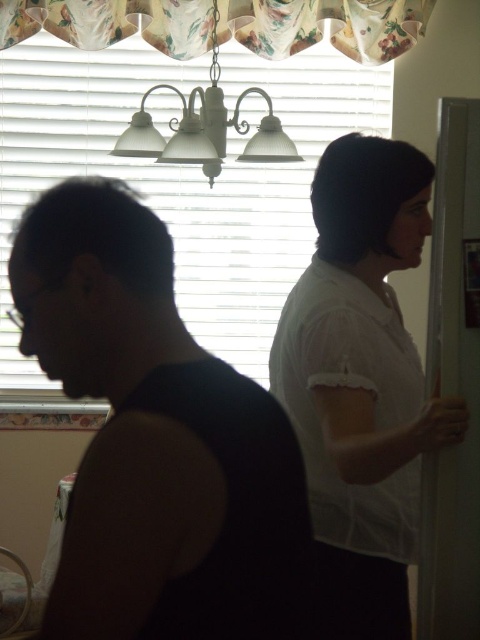
You are a delivery person who needs to place a small package between the white sheer blouse at right and the white textured lamp at upper center. The package is 3.5 feet long. Will it fit in the space between them?

The distance between the white sheer blouse at right and the white textured lamp at upper center is 4.11 feet. Since the package is 3.5 feet long, it will fit in the space between them.

You are trying to locate the white sheer blouse at right in the image. According to the coordinates provided, where would you look first?

You should look first at the coordinates point (361, 381) where the white sheer blouse at right is located.

You are a photographer setting up lighting for a portrait in this scene. You have the white sheer blouse at right and the white textured lamp at upper center. Which object is closer to the camera based on their positions?

The white sheer blouse at right is positioned under the white textured lamp at upper center, meaning the blouse is closer to the camera than the lamp.